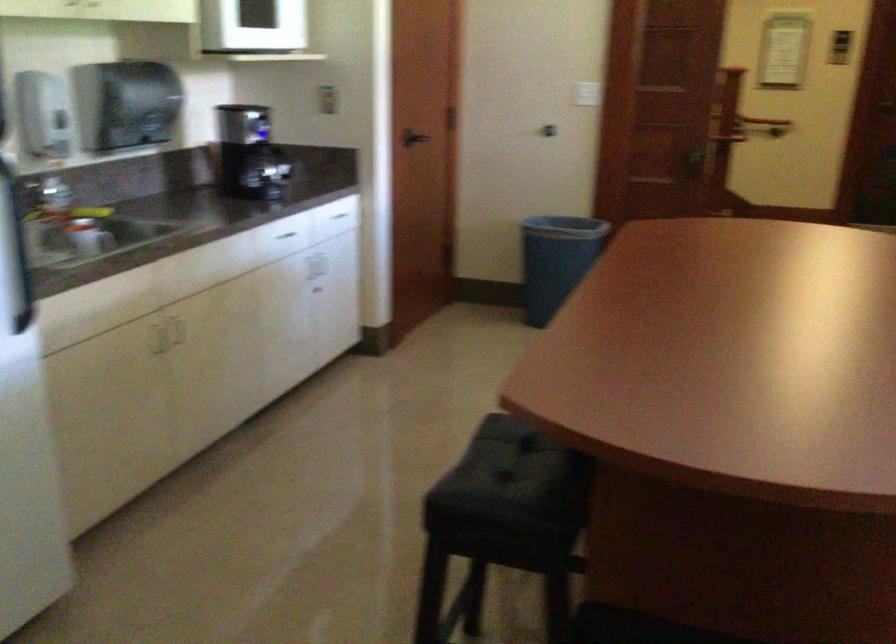
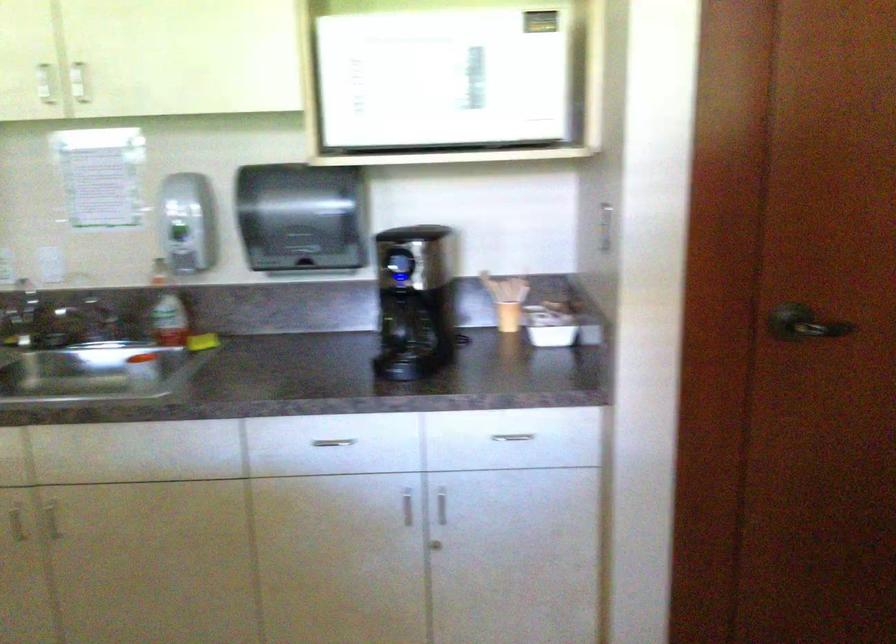
Locate, in the second image, the point that corresponds to point 253,128 in the first image.

(399, 263)